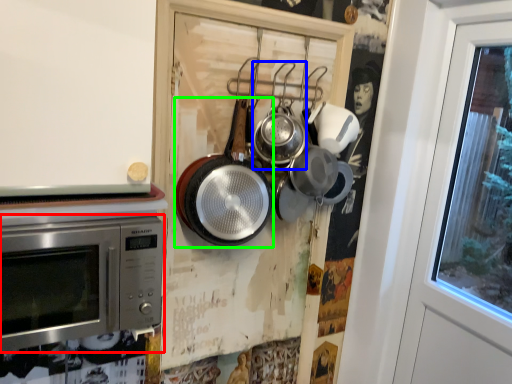
Question: Based on their relative distances, which object is nearer to microwave oven (highlighted by a red box)? Choose from frying pan (highlighted by a blue box) and frying pan (highlighted by a green box).

Choices:
 (A) frying pan
 (B) frying pan

Answer: (B)